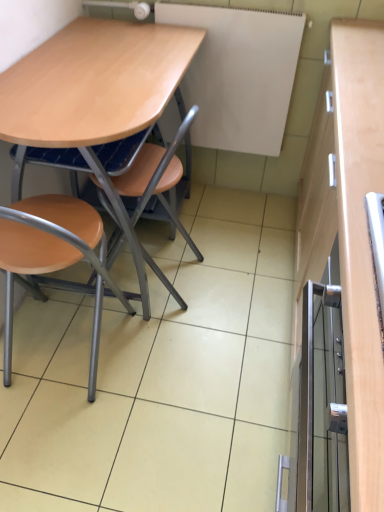
Question: Does light brown wood desk at center have a larger size compared to metallic silver cabinet at right?

Choices:
 (A) yes
 (B) no

Answer: (A)

Question: Is light brown wood desk at center not within metallic silver cabinet at right?

Choices:
 (A) no
 (B) yes

Answer: (B)

Question: Is light brown wood desk at center to the left of metallic silver cabinet at right from the viewer's perspective?

Choices:
 (A) yes
 (B) no

Answer: (A)

Question: Can metallic silver cabinet at right be found inside light brown wood desk at center?

Choices:
 (A) no
 (B) yes

Answer: (A)

Question: Can you confirm if light brown wood desk at center is smaller than metallic silver cabinet at right?

Choices:
 (A) no
 (B) yes

Answer: (A)

Question: From the image's perspective, is light brown wood desk at center above metallic silver cabinet at right?

Choices:
 (A) no
 (B) yes

Answer: (B)

Question: Is matte wood chair at center, which appears as the 2th chair when viewed from the left, at the back of matte wood chair at lower left, marked as the first chair in a left-to-right arrangement?

Choices:
 (A) yes
 (B) no

Answer: (B)

Question: Is matte wood chair at lower left, marked as the first chair in a left-to-right arrangement, not close to matte wood chair at center, which appears as the 2th chair when viewed from the left?

Choices:
 (A) yes
 (B) no

Answer: (B)

Question: Is matte wood chair at lower left, which ranks as the second chair in right-to-left order, taller than matte wood chair at center, which appears as the 2th chair when viewed from the left?

Choices:
 (A) no
 (B) yes

Answer: (A)

Question: Is matte wood chair at center, which is counted as the first chair, starting from the right, inside matte wood chair at lower left, which ranks as the second chair in right-to-left order?

Choices:
 (A) yes
 (B) no

Answer: (B)

Question: Could you tell me if matte wood chair at lower left, marked as the first chair in a left-to-right arrangement, is facing matte wood chair at center, which appears as the 2th chair when viewed from the left?

Choices:
 (A) no
 (B) yes

Answer: (B)

Question: Is matte wood chair at lower left, which ranks as the second chair in right-to-left order, positioned behind matte wood chair at center, which is counted as the first chair, starting from the right?

Choices:
 (A) yes
 (B) no

Answer: (B)

Question: From the image's perspective, is metallic silver cabinet at right over matte wood chair at lower left, marked as the first chair in a left-to-right arrangement?

Choices:
 (A) no
 (B) yes

Answer: (A)